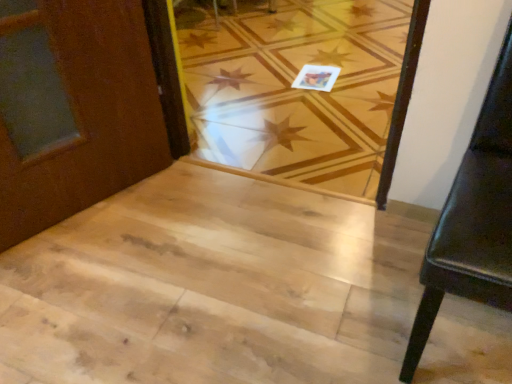
Question: Is natural wood floor at center facing towards black leather chair at right?

Choices:
 (A) yes
 (B) no

Answer: (B)

Question: Can you confirm if natural wood floor at center is bigger than black leather chair at right?

Choices:
 (A) no
 (B) yes

Answer: (B)

Question: Is natural wood floor at center next to black leather chair at right and touching it?

Choices:
 (A) no
 (B) yes

Answer: (A)

Question: Does natural wood floor at center come behind black leather chair at right?

Choices:
 (A) no
 (B) yes

Answer: (B)

Question: Does natural wood floor at center have a greater height compared to black leather chair at right?

Choices:
 (A) yes
 (B) no

Answer: (B)

Question: From a real-world perspective, does natural wood floor at center sit lower than black leather chair at right?

Choices:
 (A) no
 (B) yes

Answer: (B)

Question: Does black leather chair at right come in front of natural wood floor at center?

Choices:
 (A) no
 (B) yes

Answer: (B)

Question: Does black leather chair at right appear on the right side of natural wood floor at center?

Choices:
 (A) yes
 (B) no

Answer: (A)

Question: Is black leather chair at right to the left of natural wood floor at center from the viewer's perspective?

Choices:
 (A) no
 (B) yes

Answer: (A)

Question: Does black leather chair at right have a lesser height compared to natural wood floor at center?

Choices:
 (A) yes
 (B) no

Answer: (B)

Question: Does black leather chair at right have a smaller size compared to natural wood floor at center?

Choices:
 (A) no
 (B) yes

Answer: (B)

Question: Considering the relative sizes of black leather chair at right and natural wood floor at center in the image provided, is black leather chair at right wider than natural wood floor at center?

Choices:
 (A) yes
 (B) no

Answer: (B)

Question: Is natural wood stairwell at center thinner than natural wood floor at center?

Choices:
 (A) no
 (B) yes

Answer: (B)